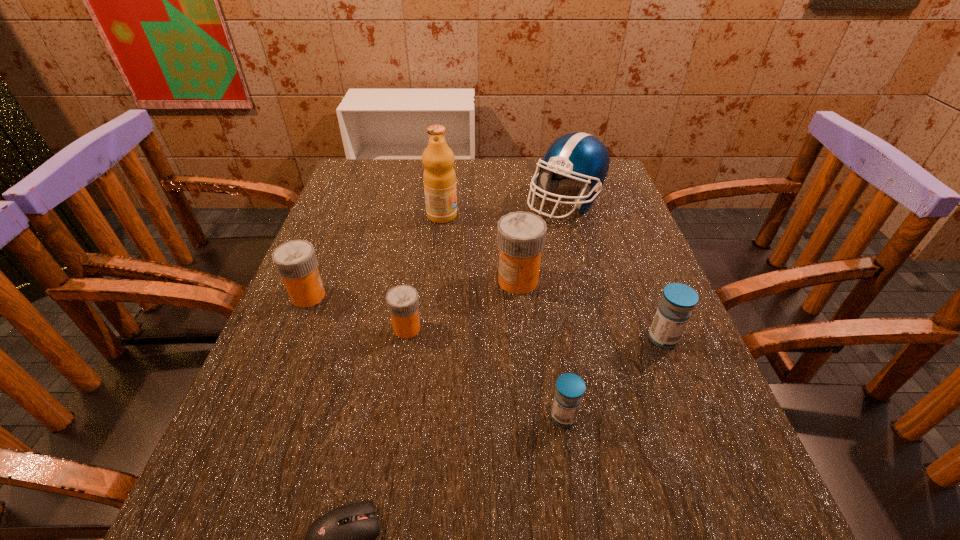
I want to click on the tallest object, so click(439, 178).

The width and height of the screenshot is (960, 540). I want to click on the second tallest object, so click(x=578, y=159).

The height and width of the screenshot is (540, 960). I want to click on blue football helmet, so pyautogui.click(x=578, y=159).

Where is `the tallest medicine`? Image resolution: width=960 pixels, height=540 pixels. the tallest medicine is located at coordinates (521, 236).

Where is `the rightmost orange medicine`? the rightmost orange medicine is located at coordinates (521, 236).

The width and height of the screenshot is (960, 540). I want to click on the leftmost orange medicine, so click(x=296, y=262).

The width and height of the screenshot is (960, 540). What are the coordinates of `the leftmost medicine` in the screenshot? It's located at (296, 262).

Identify the location of the farther blue medicine. Image resolution: width=960 pixels, height=540 pixels. (678, 300).

Where is `the right blue medicine`? This screenshot has height=540, width=960. the right blue medicine is located at coordinates (678, 300).

Image resolution: width=960 pixels, height=540 pixels. I want to click on the nearest orange medicine, so click(x=402, y=301).